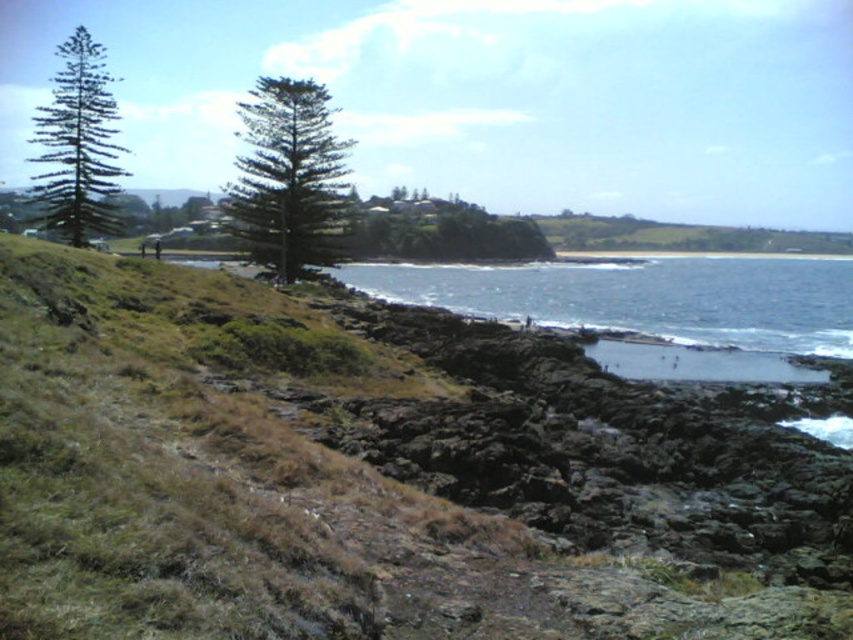
Can you confirm if green grassy hill at lower left is smaller than green needle-like foliage at upper left?

Correct, green grassy hill at lower left occupies less space than green needle-like foliage at upper left.

Between point (659, 483) and point (68, 90), which one is positioned in front?

Positioned in front is point (659, 483).

The width and height of the screenshot is (853, 640). What are the coordinates of `green grassy hill at lower left` in the screenshot? It's located at (383, 474).

Who is lower down, green grassy hill at lower left or clear blue water at lower right?

green grassy hill at lower left is below.

Who is more distant from viewer, [610,412] or [550,262]?

The point [550,262] is behind.

Where is `green grassy hill at lower left`? The height and width of the screenshot is (640, 853). green grassy hill at lower left is located at coordinates (383, 474).

Locate an element on the screen. Image resolution: width=853 pixels, height=640 pixels. green needle-like foliage at center is located at coordinates (289, 177).

Is green needle-like foliage at center positioned in front of green needle-like foliage at upper left?

No, it is behind green needle-like foliage at upper left.

Who is more distant from viewer, (276, 257) or (65, 97)?

Positioned behind is point (276, 257).

Image resolution: width=853 pixels, height=640 pixels. Identify the location of green needle-like foliage at center. (289, 177).